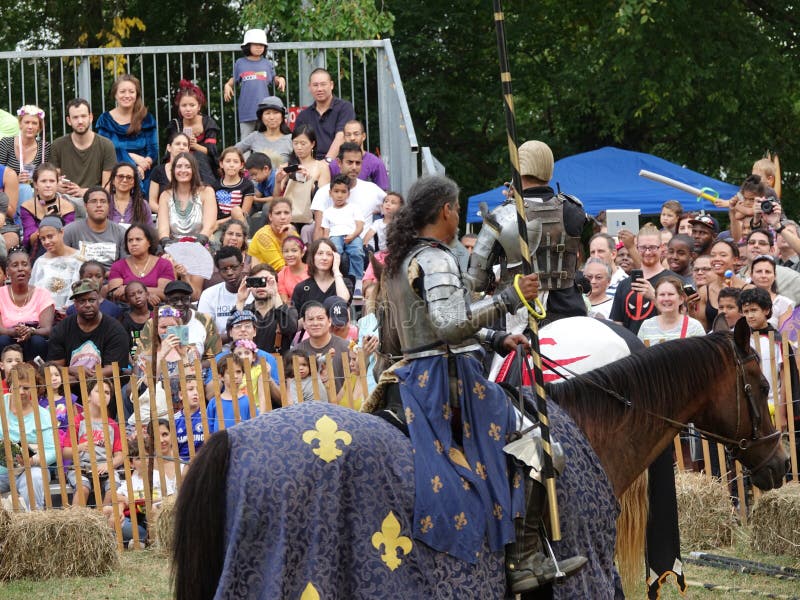
Where is `blue blanket`? The height and width of the screenshot is (600, 800). blue blanket is located at coordinates (305, 490), (382, 473), (458, 572), (590, 482), (257, 452).